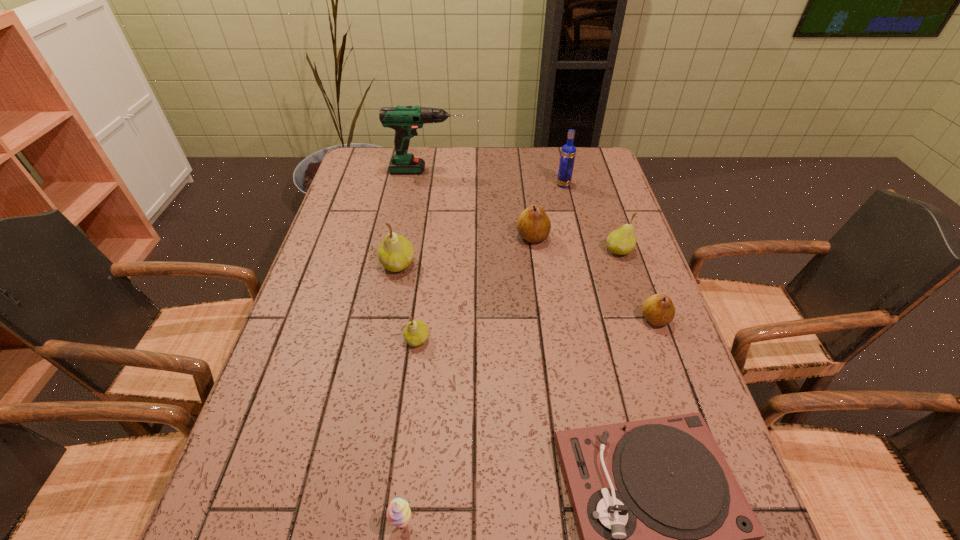
Image resolution: width=960 pixels, height=540 pixels. I want to click on vacant position located on the right of the smallest green pear, so click(516, 340).

The width and height of the screenshot is (960, 540). I want to click on free space located 0.160m on the right of the sherbert, so click(x=508, y=524).

Image resolution: width=960 pixels, height=540 pixels. What are the coordinates of `drill that is at the far edge` in the screenshot? It's located at (405, 120).

In order to click on vodka located in the far edge section of the desktop in this screenshot , I will do `click(568, 152)`.

Find the location of a particular element. This screenshot has height=540, width=960. object that is at the near edge is located at coordinates (398, 513).

At what (x,y) coordinates should I click in order to perform the action: click on object located in the left edge section of the desktop. Please return your answer as a coordinate pair (x, y). This screenshot has height=540, width=960. Looking at the image, I should click on (405, 120).

Where is `vodka positioned at the right edge`? vodka positioned at the right edge is located at coordinates (x=568, y=152).

Image resolution: width=960 pixels, height=540 pixels. I want to click on object that is at the far left corner, so click(405, 120).

The image size is (960, 540). Find the location of `object located in the far right corner section of the desktop`. object located in the far right corner section of the desktop is located at coordinates (568, 152).

In order to click on vacant space at the far edge of the desktop in this screenshot , I will do `click(517, 161)`.